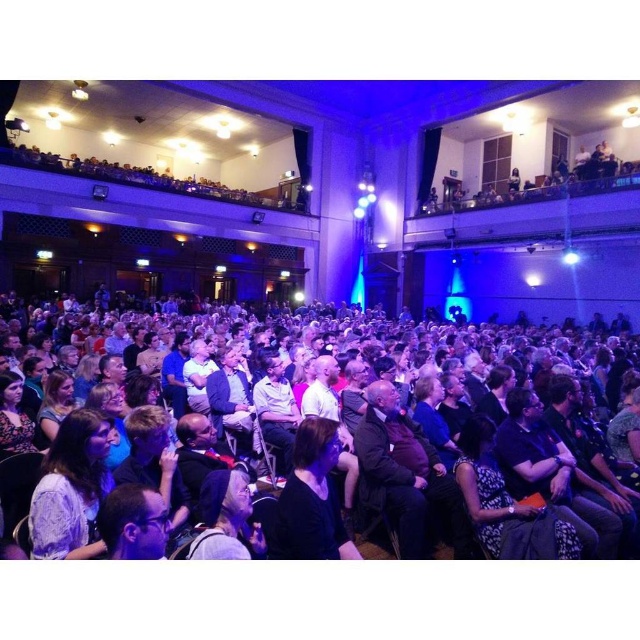
You are an event organizer planning to seat guests in this theater. You have two guests arriving late who need to be seated quickly. One is wearing the light purple lace dress at lower left and the other is wearing the dark brown leather jacket at center. Considering their clothing sizes, which guest might require more space when moving through the aisles?

The light purple lace dress at lower left is larger in size than the dark brown leather jacket at center, so the guest wearing the light purple lace dress at lower left would require more space when moving through the aisles.